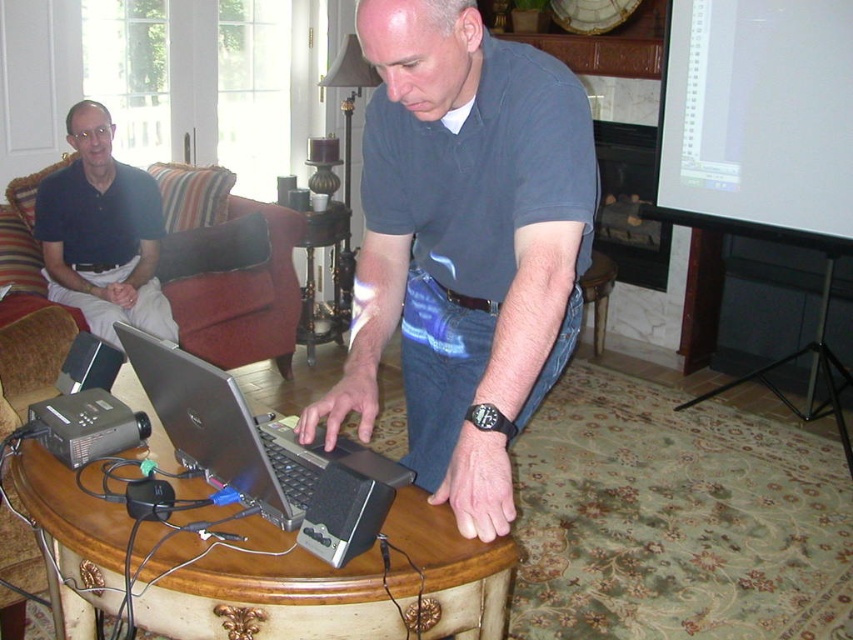
Question: Does matte black laptop at center appear on the left side of wooden stool at lower center?

Choices:
 (A) no
 (B) yes

Answer: (B)

Question: Which object is closer to the camera taking this photo?

Choices:
 (A) wooden stool at lower center
 (B) matte black laptop at left
 (C) wooden table at center
 (D) silver metallic laptop at center

Answer: (C)

Question: Does matte black laptop at left appear on the right side of silver metallic laptop at center?

Choices:
 (A) yes
 (B) no

Answer: (B)

Question: Is silver metallic laptop at center positioned before wooden stool at lower center?

Choices:
 (A) no
 (B) yes

Answer: (B)

Question: Which point is farther from the camera taking this photo?

Choices:
 (A) 566,170
 (B) 341,250
 (C) 592,269

Answer: (B)

Question: Which object appears farthest from the camera in this image?

Choices:
 (A) metallic gold side table at center
 (B) silver metallic laptop at center

Answer: (A)